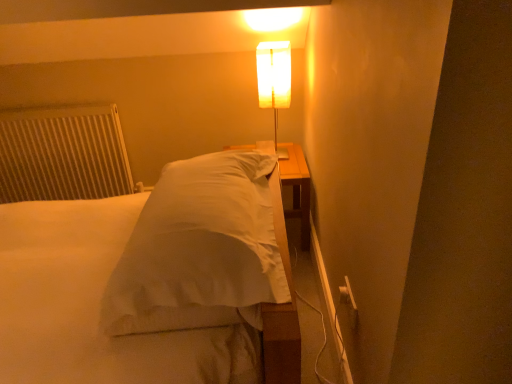
Where is `white satin bed at center`? The width and height of the screenshot is (512, 384). white satin bed at center is located at coordinates (108, 298).

Measure the distance between point (284, 65) and camera.

Point (284, 65) and camera are 6.58 feet apart.

This screenshot has height=384, width=512. What are the coordinates of `white satin bed at center` in the screenshot? It's located at (108, 298).

Is white textured radiator at left smaller than white satin bed at center?

Yes.

Can you tell me how much white textured radiator at left and white satin bed at center differ in facing direction?

66.8 degrees separate the facing orientations of white textured radiator at left and white satin bed at center.

Is white textured radiator at left facing towards white satin bed at center?

Yes, white textured radiator at left is oriented towards white satin bed at center.

Is point (276, 106) closer or farther from the camera than point (126, 342)?

Clearly, point (276, 106) is more distant from the camera than point (126, 342).

Does translucent white lamp at upper center turn towards white satin bed at center?

No, translucent white lamp at upper center is not facing towards white satin bed at center.

From a real-world perspective, between translucent white lamp at upper center and white satin bed at center, who is vertically lower?

From a 3D spatial view, white satin bed at center is below.

Locate an element on the screen. bed on the left of translucent white lamp at upper center is located at coordinates (108, 298).

Could you tell me if white satin bed at center is turned towards white textured radiator at left?

No, white satin bed at center is not oriented towards white textured radiator at left.

Which point is more distant from viewer, (175, 374) or (90, 163)?

The point (90, 163) is behind.

Who is bigger, white satin bed at center or white textured radiator at left?

Bigger between the two is white satin bed at center.

Considering the relative positions of white satin bed at center and translucent white lamp at upper center in the image provided, is white satin bed at center to the left or to the right of translucent white lamp at upper center?

Clearly, white satin bed at center is on the left of translucent white lamp at upper center in the image.

Considering the points (209, 311) and (271, 104), which point is behind, point (209, 311) or point (271, 104)?

The point (271, 104) is farther.

Looking at the image, does white satin bed at center seem bigger or smaller compared to translucent white lamp at upper center?

Clearly, white satin bed at center is larger in size than translucent white lamp at upper center.

From a real-world perspective, is white textured radiator at left physically located above or below translucent white lamp at upper center?

white textured radiator at left is situated lower than translucent white lamp at upper center in the real world.

Can you confirm if white textured radiator at left is positioned to the left of translucent white lamp at upper center?

Correct, you'll find white textured radiator at left to the left of translucent white lamp at upper center.

Is white textured radiator at left shorter than translucent white lamp at upper center?

Incorrect, the height of white textured radiator at left does not fall short of that of translucent white lamp at upper center.

In the scene shown: Would you say translucent white lamp at upper center is outside white textured radiator at left?

Absolutely, translucent white lamp at upper center is external to white textured radiator at left.

In terms of height, does translucent white lamp at upper center look taller or shorter compared to white textured radiator at left?

Considering their sizes, translucent white lamp at upper center has less height than white textured radiator at left.

The image size is (512, 384). I want to click on radiator that is under the translucent white lamp at upper center (from a real-world perspective), so click(x=63, y=154).

Between translucent white lamp at upper center and white textured radiator at left, which one has smaller width?

Thinner between the two is white textured radiator at left.

The width and height of the screenshot is (512, 384). Find the location of `bed positioned vertically above the white textured radiator at left (from a real-world perspective)`. bed positioned vertically above the white textured radiator at left (from a real-world perspective) is located at coordinates (108, 298).

You are a GUI agent. You are given a task and a screenshot of the screen. Output one action in this format:
    pyautogui.click(x=<x>, y=<y>)
    Task: Click on the lamp that is on the right side of white satin bed at center
    The height and width of the screenshot is (384, 512).
    Given the screenshot: What is the action you would take?
    pyautogui.click(x=274, y=81)

Which object lies further to the anchor point white satin bed at center, translucent white lamp at upper center or white textured radiator at left?

Among the two, translucent white lamp at upper center is located further to white satin bed at center.

Based on their spatial positions, is white satin bed at center or translucent white lamp at upper center closer to white textured radiator at left?

white satin bed at center is closer to white textured radiator at left.

Considering their positions, is white textured radiator at left positioned further to translucent white lamp at upper center than white satin bed at center?

white textured radiator at left.

Estimate the real-world distances between objects in this image. Which object is further from white textured radiator at left, translucent white lamp at upper center or white satin bed at center?

The object further to white textured radiator at left is translucent white lamp at upper center.

Estimate the real-world distances between objects in this image. Which object is further from translucent white lamp at upper center, white satin bed at center or white textured radiator at left?

The object further to translucent white lamp at upper center is white textured radiator at left.

From the image, which object appears to be farther from white satin bed at center, white textured radiator at left or translucent white lamp at upper center?

translucent white lamp at upper center.

In order to click on lamp between white satin bed at center and white textured radiator at left from front to back in this screenshot , I will do `click(274, 81)`.